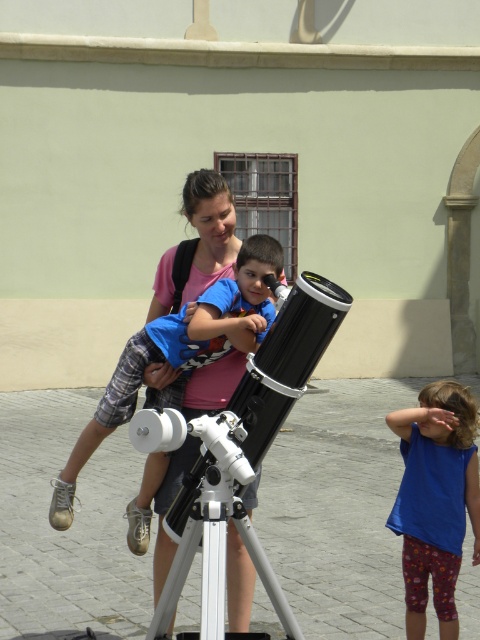
Question: Does blue cotton shirt at center appear over blue fabric shirt at center?

Choices:
 (A) no
 (B) yes

Answer: (B)

Question: Is blue cotton shirt at center wider than blue fabric shirt at center?

Choices:
 (A) no
 (B) yes

Answer: (B)

Question: Which object is closer to the camera taking this photo?

Choices:
 (A) blue fabric shirt at center
 (B) blue cotton shirt at center

Answer: (B)

Question: Which of the following is the farthest from the observer?

Choices:
 (A) (256, 273)
 (B) (443, 497)

Answer: (B)

Question: Does blue cotton shirt at center come in front of blue fabric shirt at center?

Choices:
 (A) yes
 (B) no

Answer: (A)